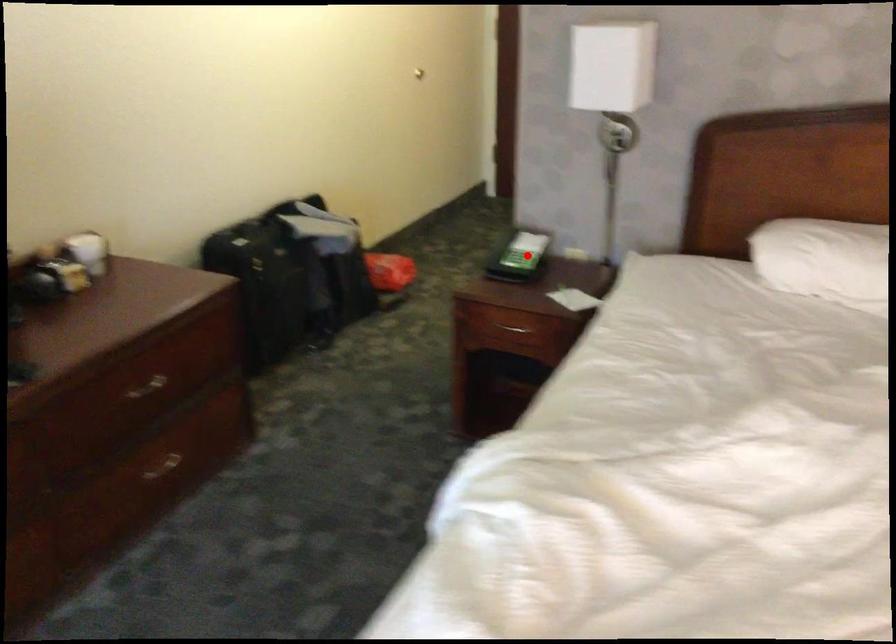
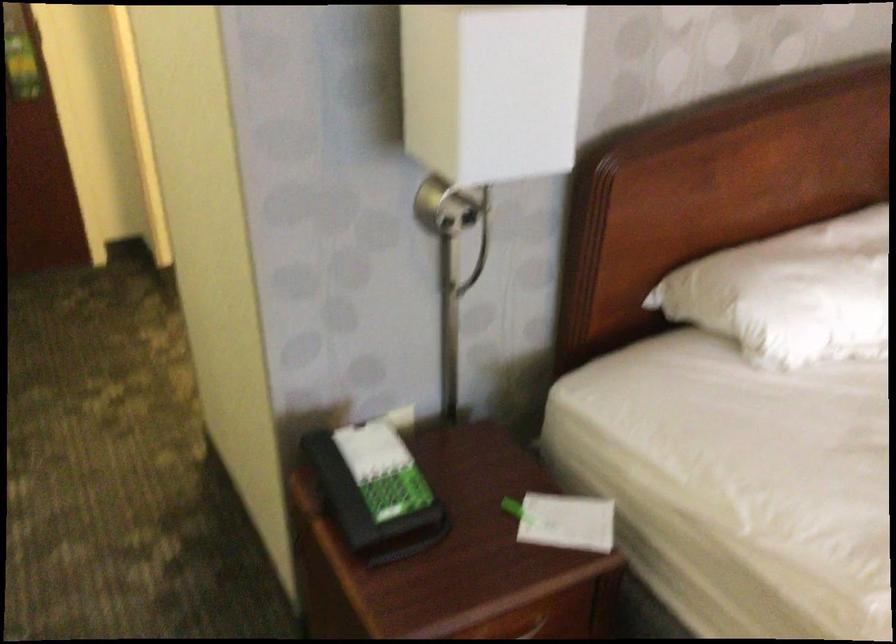
Question: I am providing you with two images of the same scene from different viewpoints. Given a red point in image1, look at the same physical point in image2. Is it:

Choices:
 (A) Closer to the viewpoint
 (B) Farther from the viewpoint

Answer: (A)